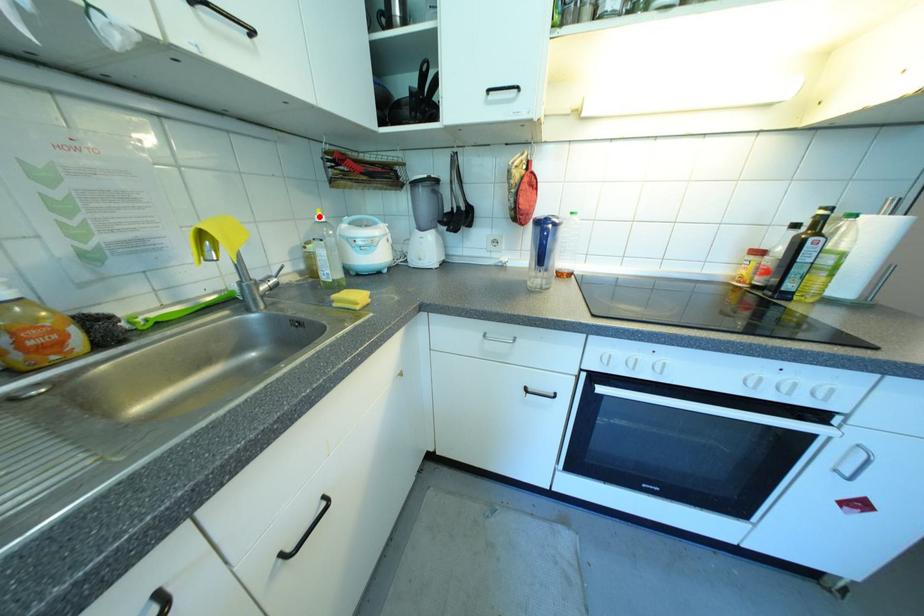
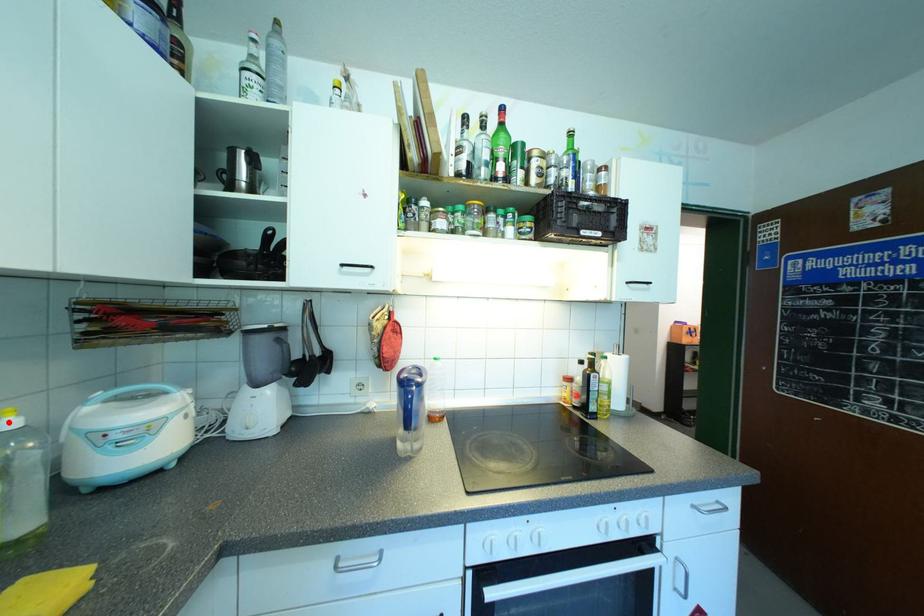
I am providing you with two images of the same scene from different viewpoints. A red point is marked on the first image and another point is marked on the second image. Is the marked point in image1 the same physical position as the marked point in image2?

Yes